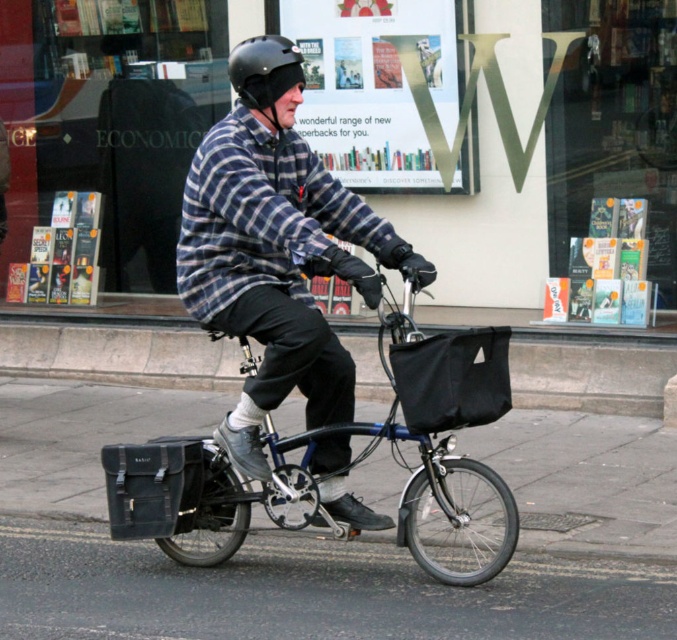
You are a pedestrian standing on the sidewalk observing the cyclist. Which item is closer to you between the plaid flannel shirt at center and the black matte helmet at center?

The plaid flannel shirt at center is closer to the viewer than the black matte helmet at center.

Based on the photo, you are a fashion designer observing the cyclist in the scene. You notice the plaid flannel shirt at center and the metallic blue bicycle at center. Which item is taller?

The plaid flannel shirt at center is taller than the metallic blue bicycle at center.

Where is the plaid flannel shirt at center located in the image?

The plaid flannel shirt at center is located at point (x=276, y=248).